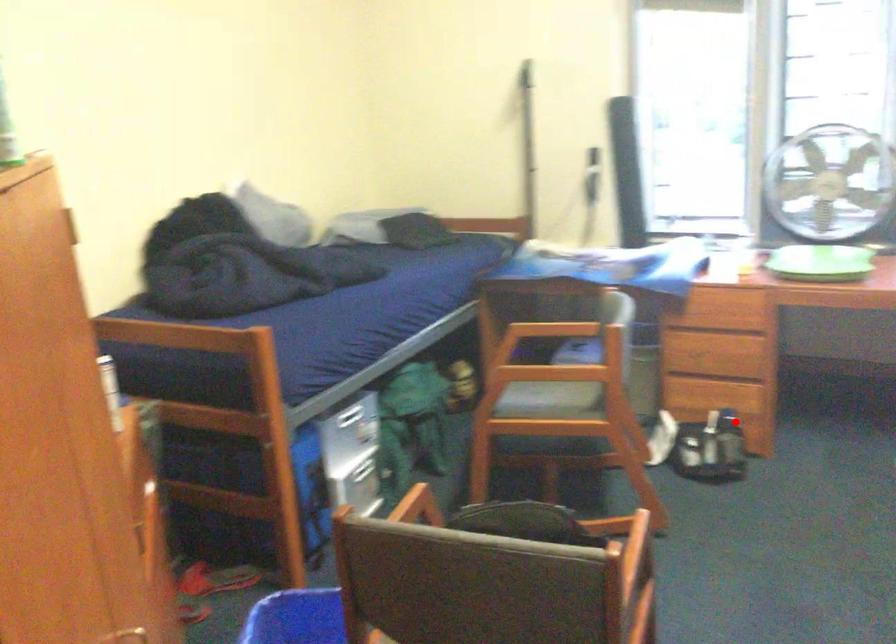
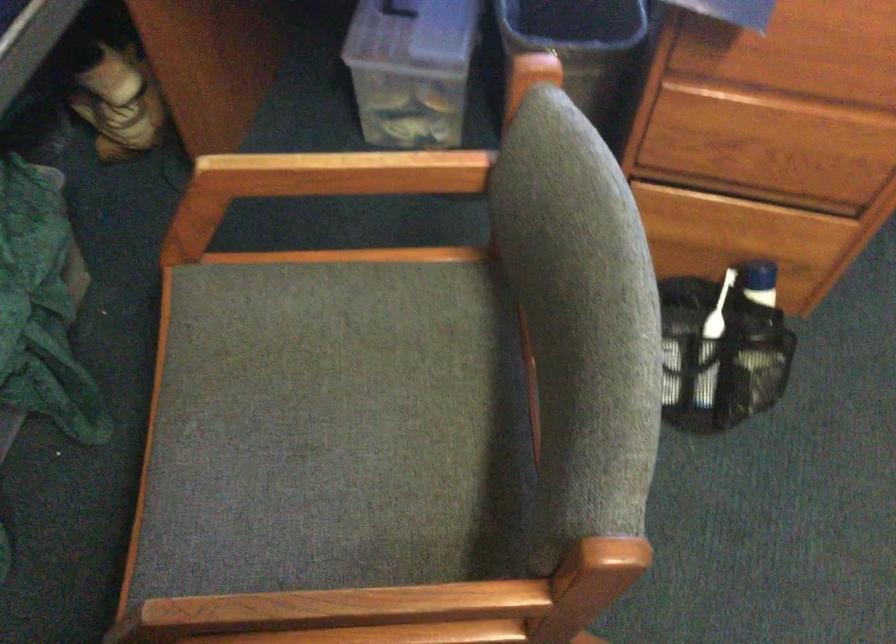
Find the pixel in the second image that matches the highlighted location in the first image.

(757, 303)